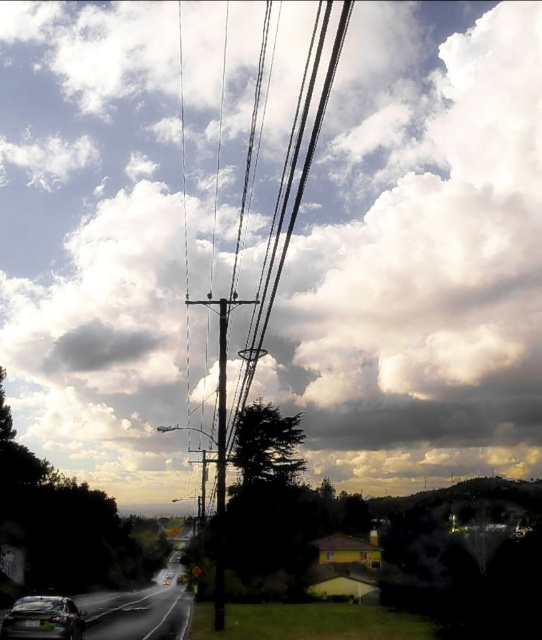
You are driving a car that is 15 feet long and want to park it between the smooth metallic pole at center and the shiny black sedan at lower left. Is there enough space between them to park your car?

The distance between the smooth metallic pole at center and the shiny black sedan at lower left is 51.06 feet. Since your car is only 15 feet long, there is more than enough space to park between them.

You are driving a shiny black sedan at lower left and want to park it near the smooth metallic pole at center. Can you park it directly to the left of the pole without moving any other vehicles?

The smooth metallic pole at center is positioned on the right side of shiny black sedan at lower left, so the sedan is already to the left of the pole. Therefore, you can park it directly to the left of the pole without moving any other vehicles.